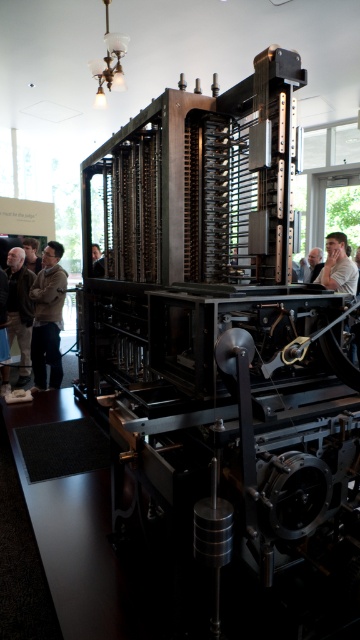
Question: Can you confirm if brown leather jacket at left is positioned below light brown hair at right?

Choices:
 (A) no
 (B) yes

Answer: (B)

Question: Which of the following is the farthest from the observer?

Choices:
 (A) (21, 298)
 (B) (306, 266)
 (C) (57, 244)

Answer: (B)

Question: Which object is closer to the camera taking this photo?

Choices:
 (A) light brown leather jacket at center
 (B) brown leather jacket at left
 (C) light brown hair at right

Answer: (C)

Question: Which object is the closest to the dark brown leather jacket at lower left?

Choices:
 (A) light brown hair at right
 (B) light brown leather jacket at center
 (C) brown leather jacket at left

Answer: (C)

Question: Is brown leather jacket at left positioned in front of light brown leather jacket at center?

Choices:
 (A) no
 (B) yes

Answer: (A)

Question: Does brown leather jacket at left appear on the right side of light brown leather jacket at center?

Choices:
 (A) yes
 (B) no

Answer: (B)